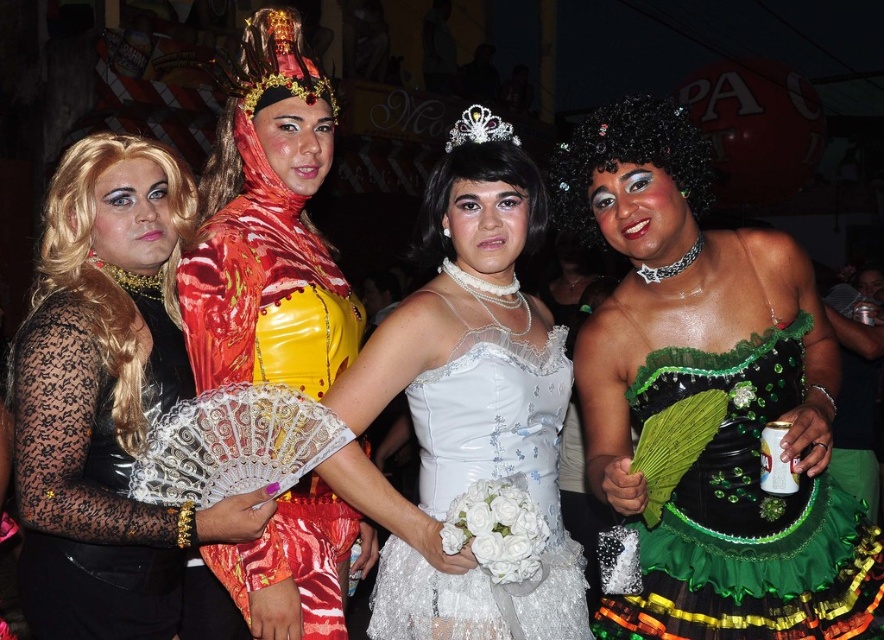
Question: Is the position of black lace dress at left less distant than that of shiny metallic fan at center?

Choices:
 (A) yes
 (B) no

Answer: (A)

Question: Estimate the real-world distances between objects in this image. Which object is farther from the shiny metallic fan at center?

Choices:
 (A) white satin dress at center
 (B) green sequined dress at right
 (C) black lace dress at left
 (D) shiny red fabric at center

Answer: (C)

Question: Does shiny red fabric at center come in front of green sequined dress at right?

Choices:
 (A) yes
 (B) no

Answer: (B)

Question: Which is farther from the shiny red fabric at center?

Choices:
 (A) green sequined dress at right
 (B) shiny metallic fan at center
 (C) white satin dress at center
 (D) black lace dress at left

Answer: (A)

Question: Can you confirm if black lace dress at left is wider than shiny metallic fan at center?

Choices:
 (A) yes
 (B) no

Answer: (A)

Question: Which of the following is the closest to the observer?

Choices:
 (A) shiny red fabric at center
 (B) black lace dress at left
 (C) green sequined dress at right

Answer: (B)